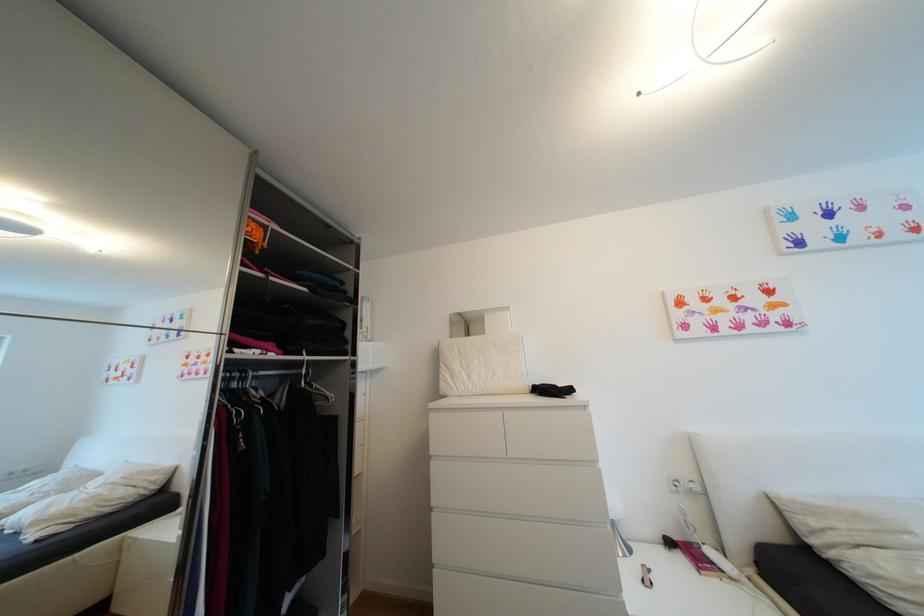
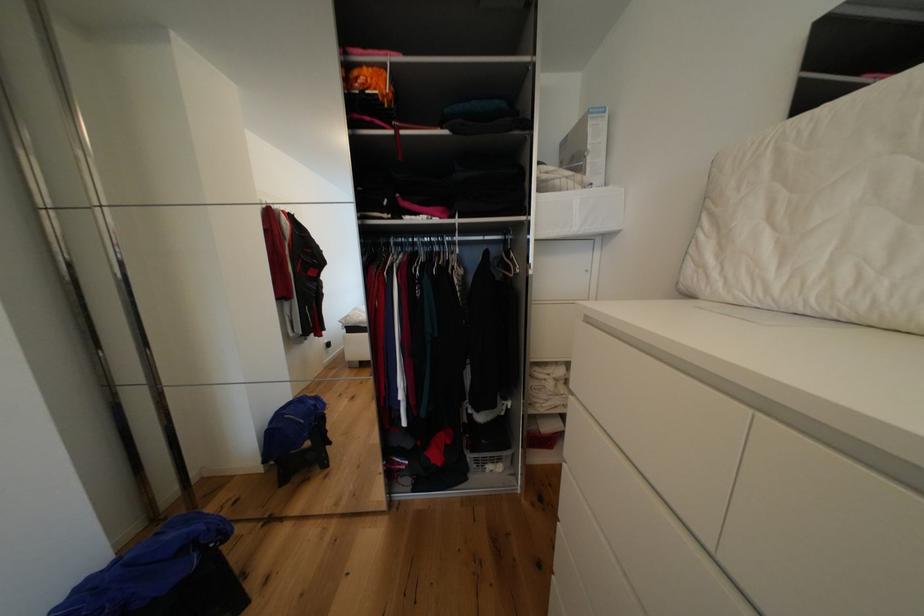
Based on the continuous images, in which direction is the camera rotating?

The camera rotated toward left-down.